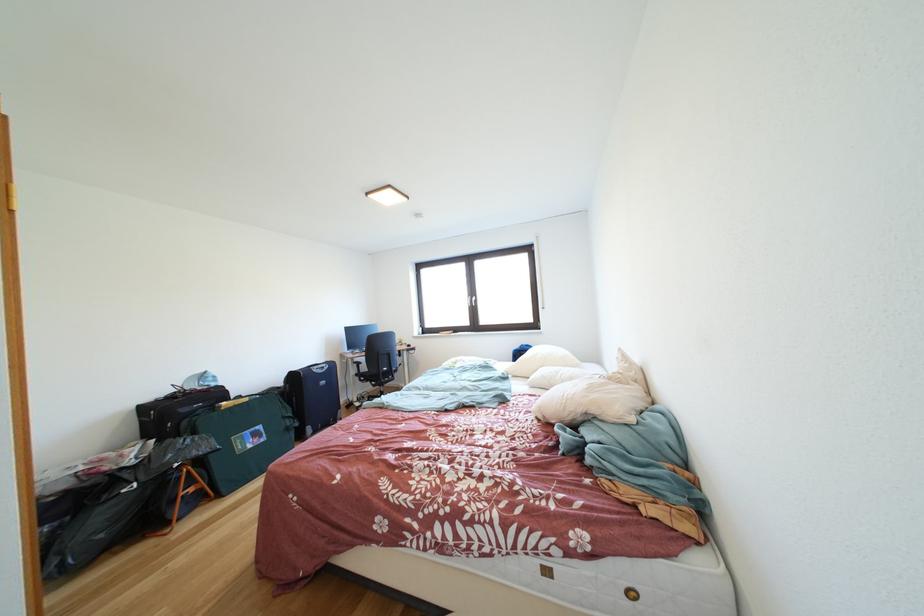
The image size is (924, 616). What are the coordinates of `chair sitting surface` in the screenshot? It's located at (379, 360).